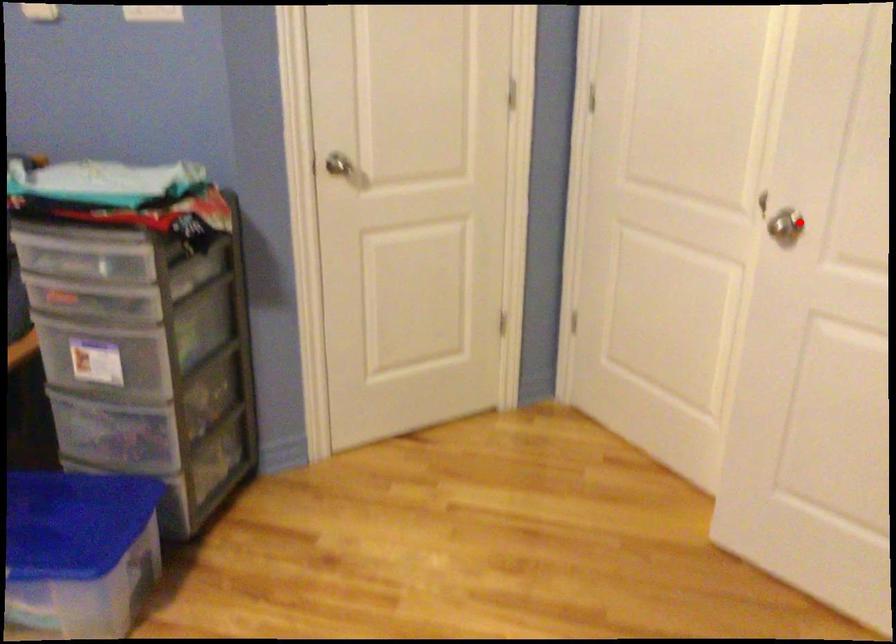
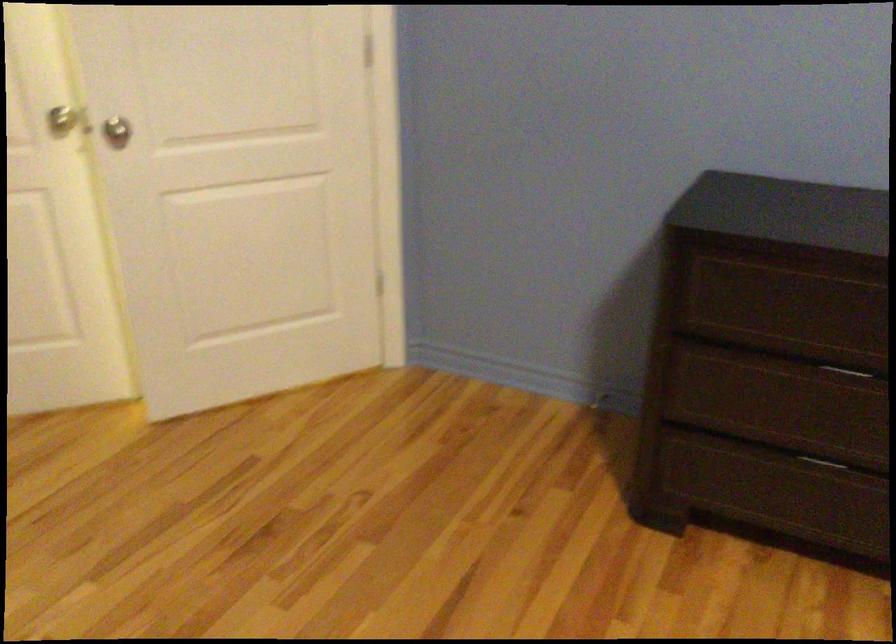
Locate, in the second image, the point that corresponds to the highlighted location in the first image.

(116, 131)